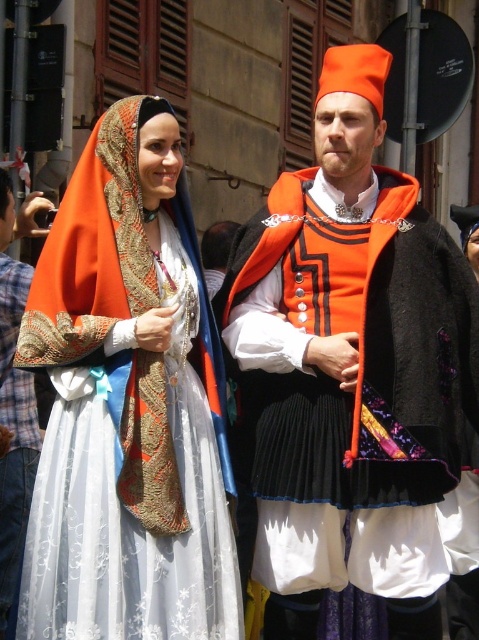
Which is below, matte orange shawl at center or matte orange fabric at center?

matte orange fabric at center is lower down.

Does matte orange shawl at center appear over matte orange fabric at center?

Yes, matte orange shawl at center is above matte orange fabric at center.

Image resolution: width=479 pixels, height=640 pixels. Find the location of `matte orange shawl at center`. matte orange shawl at center is located at coordinates point(126,412).

You are a GUI agent. You are given a task and a screenshot of the screen. Output one action in this format:
    pyautogui.click(x=<x>, y=<y>)
    Task: Click on the matte orange shawl at center
    The height and width of the screenshot is (640, 479).
    Given the screenshot: What is the action you would take?
    126,412